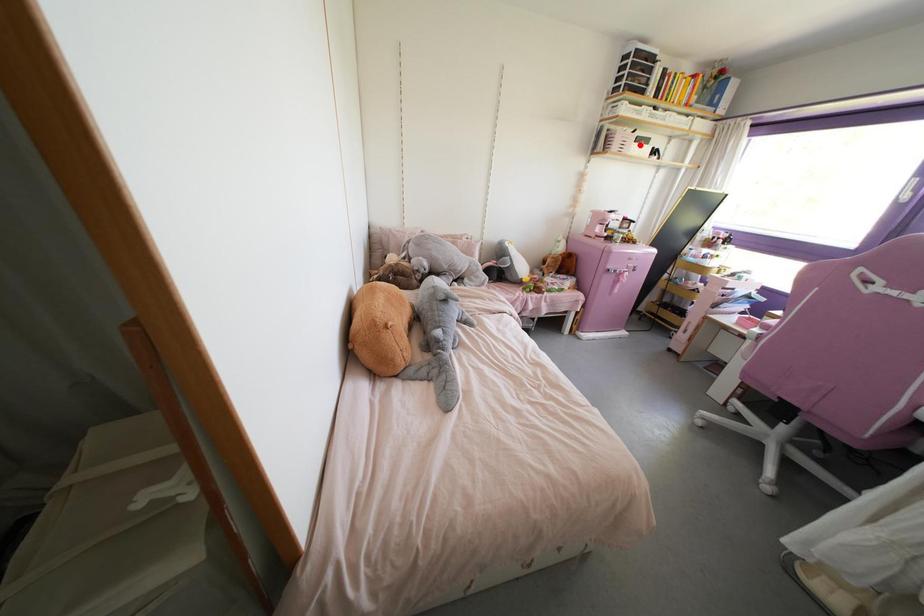
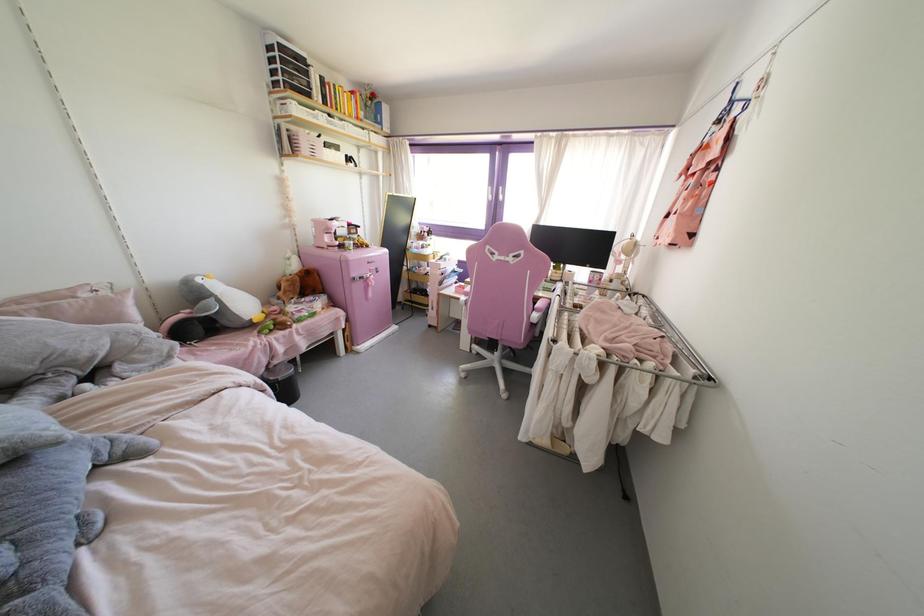
Where in the second image is the point corresponding to the highlighted location from the first image?

(333, 151)